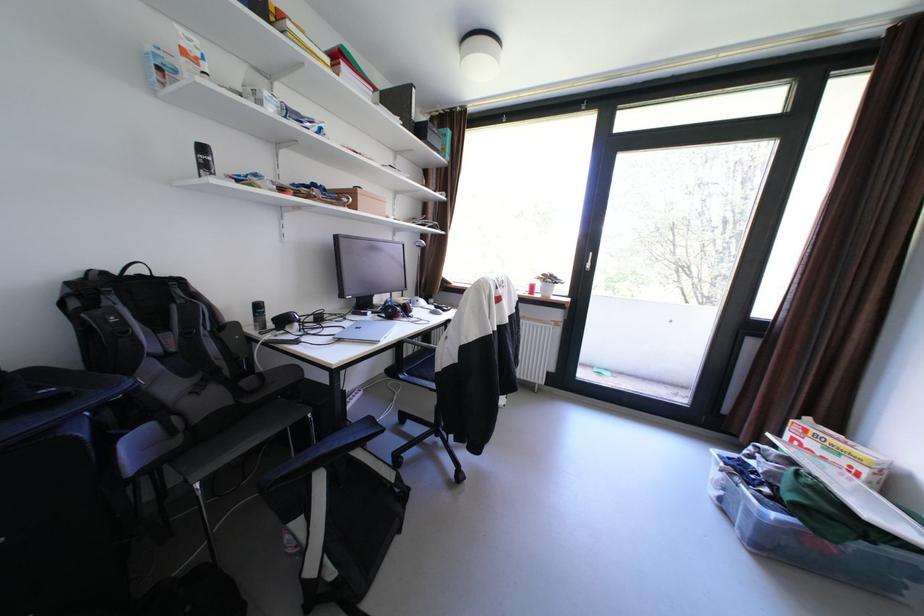
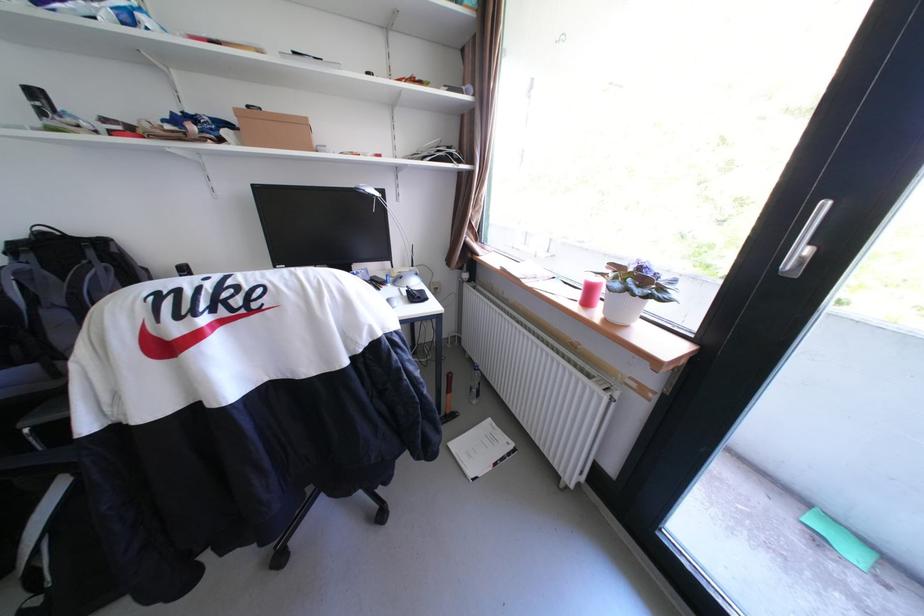
In the second image, find the point that corresponds to [549,296] in the first image.

(608, 313)